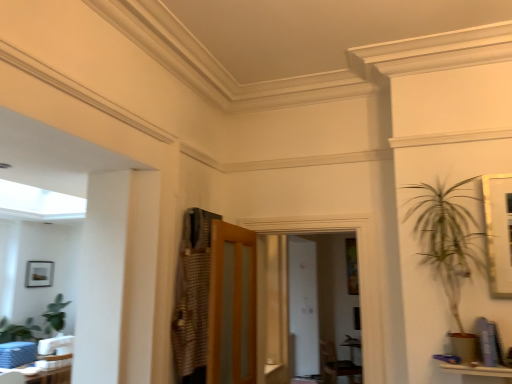
Question: From the image's perspective, is matte black picture frame at left on top of checkered fabric armoire at center?

Choices:
 (A) no
 (B) yes

Answer: (A)

Question: Would you say matte black picture frame at left is outside checkered fabric armoire at center?

Choices:
 (A) no
 (B) yes

Answer: (B)

Question: Is matte black picture frame at left at the left side of checkered fabric armoire at center?

Choices:
 (A) yes
 (B) no

Answer: (A)

Question: Is matte black picture frame at left bigger than checkered fabric armoire at center?

Choices:
 (A) no
 (B) yes

Answer: (A)

Question: Can you confirm if matte black picture frame at left is wider than checkered fabric armoire at center?

Choices:
 (A) yes
 (B) no

Answer: (B)

Question: From their relative heights in the image, would you say checkered fabric armoire at center is taller or shorter than wooden frosted glass door at center?

Choices:
 (A) short
 (B) tall

Answer: (A)

Question: Based on their sizes in the image, would you say checkered fabric armoire at center is bigger or smaller than wooden frosted glass door at center?

Choices:
 (A) small
 (B) big

Answer: (A)

Question: From the image's perspective, is checkered fabric armoire at center located above or below wooden frosted glass door at center?

Choices:
 (A) above
 (B) below

Answer: (A)

Question: Would you say checkered fabric armoire at center is inside or outside wooden frosted glass door at center?

Choices:
 (A) inside
 (B) outside

Answer: (B)

Question: Is wooden frosted glass door at center taller or shorter than white glossy table at lower left?

Choices:
 (A) short
 (B) tall

Answer: (B)

Question: Considering the relative positions of wooden frosted glass door at center and white glossy table at lower left in the image provided, is wooden frosted glass door at center to the left or to the right of white glossy table at lower left?

Choices:
 (A) right
 (B) left

Answer: (A)

Question: Is wooden frosted glass door at center inside the boundaries of white glossy table at lower left, or outside?

Choices:
 (A) outside
 (B) inside

Answer: (A)

Question: Is point (249, 249) closer or farther from the camera than point (68, 355)?

Choices:
 (A) farther
 (B) closer

Answer: (B)

Question: From a real-world perspective, is white glossy table at lower left physically located above or below dark brown leather armchair at center?

Choices:
 (A) below
 (B) above

Answer: (B)

Question: From their relative heights in the image, would you say white glossy table at lower left is taller or shorter than dark brown leather armchair at center?

Choices:
 (A) tall
 (B) short

Answer: (B)